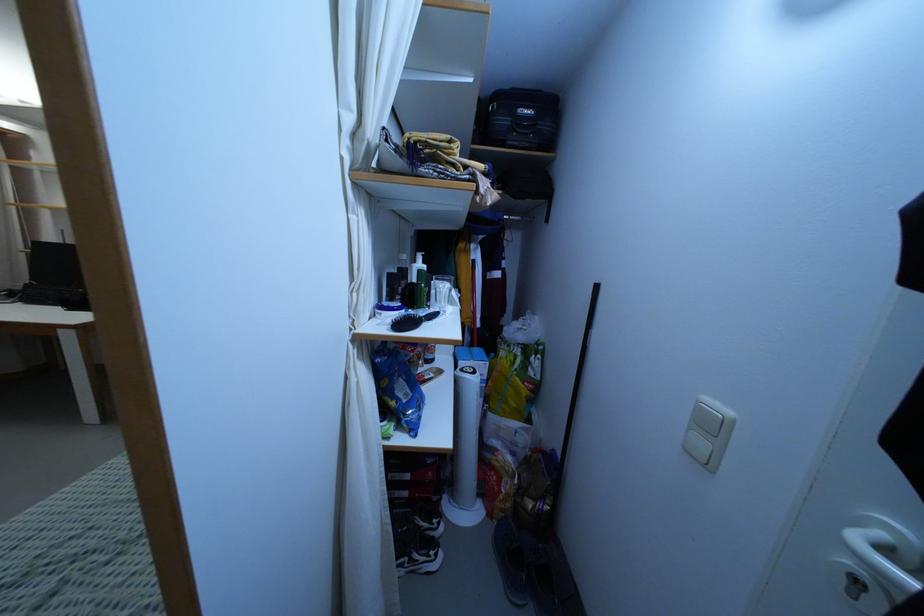
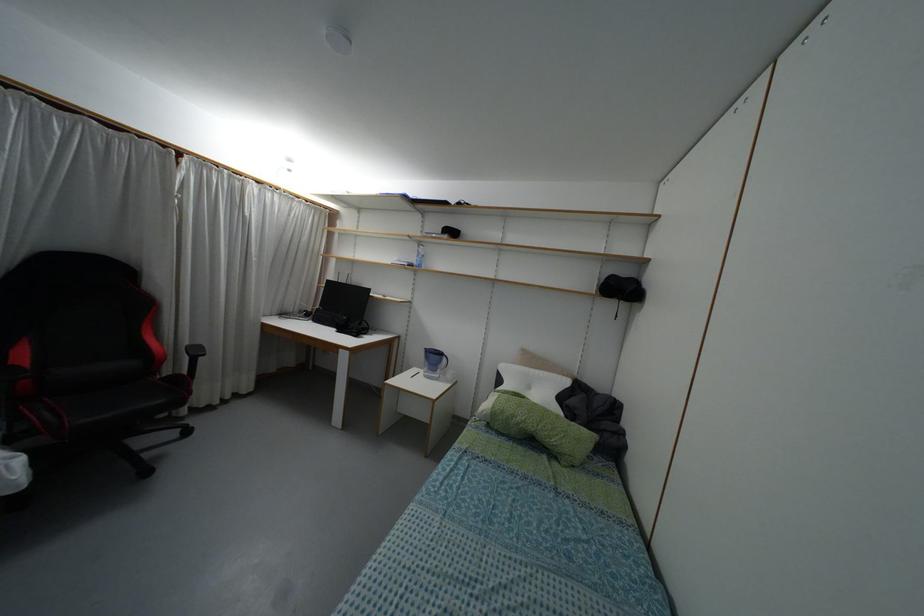
Question: The camera is either moving clockwise (left) or counter-clockwise (right) around the object. The first image is from the beginning of the video and the second image is from the end. Is the camera moving left or right when shooting the video?

Choices:
 (A) Left
 (B) Right

Answer: (B)